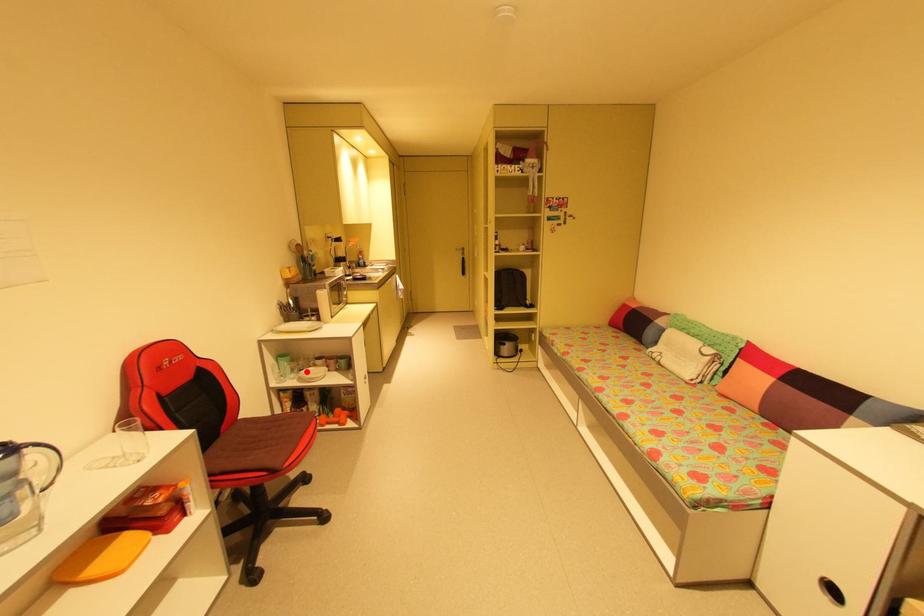
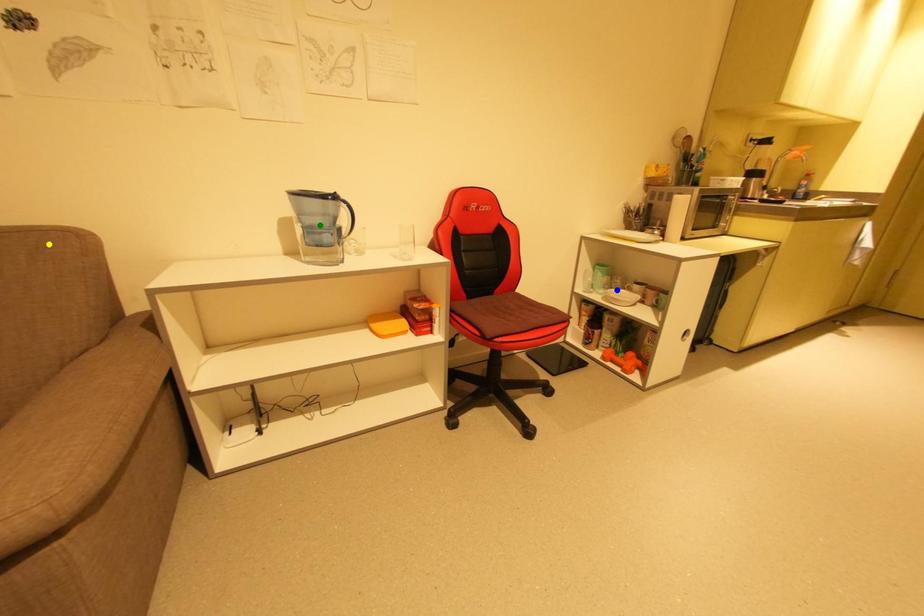
Question: I am providing you with two images of the same scene from different viewpoints. A red point is marked on the first image. You are given multiple points on the second image. Which point in image 2 represents the same 3d spot as the red point in image 1?

Choices:
 (A) green point
 (B) blue point
 (C) yellow point

Answer: (B)